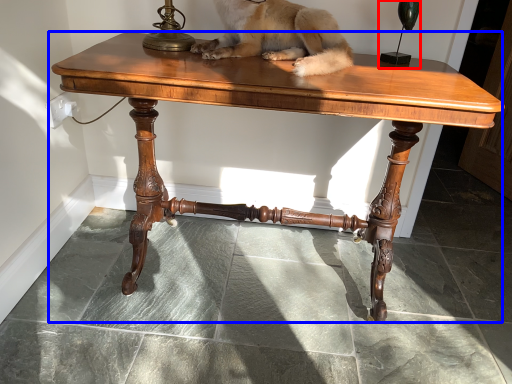
Question: Among these objects, which one is nearest to the camera, candle holder (highlighted by a red box) or table (highlighted by a blue box)?

Choices:
 (A) candle holder
 (B) table

Answer: (B)